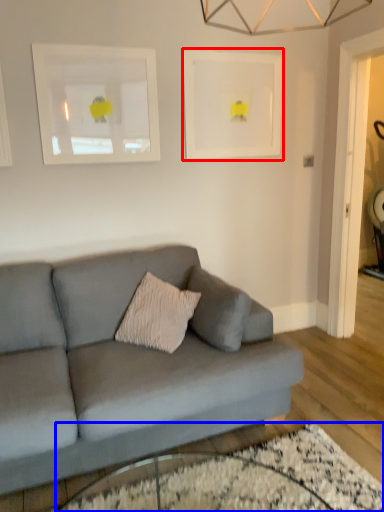
Question: Which object appears farthest to the camera in this image, picture frame (highlighted by a red box) or glass table (highlighted by a blue box)?

Choices:
 (A) picture frame
 (B) glass table

Answer: (A)